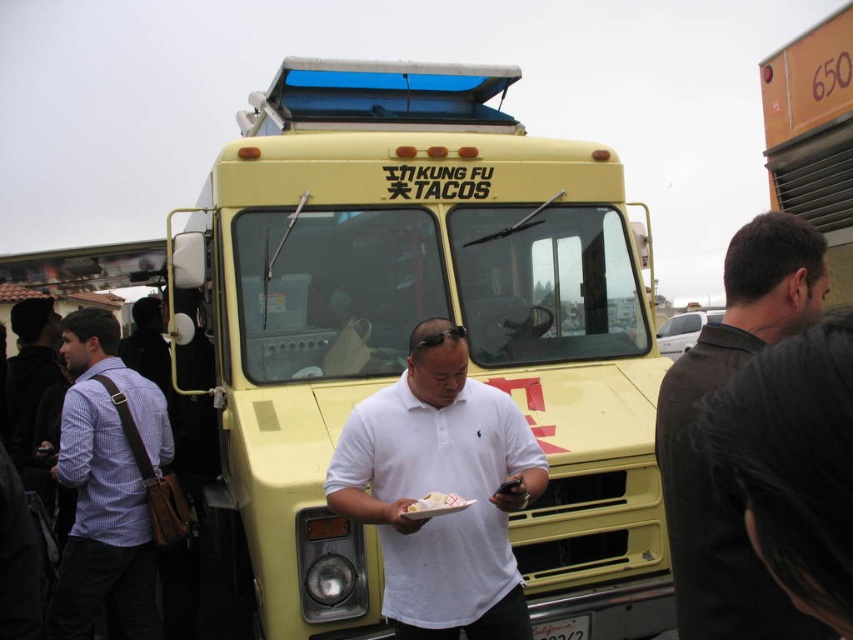
Question: Estimate the real-world distances between objects in this image. Which object is farther from the dark brown leather jacket at right?

Choices:
 (A) yellow plastic food truck at upper right
 (B) yellow matte food truck at center

Answer: (A)

Question: Can you confirm if plaid cotton shirt at left is smaller than white paper plate at center?

Choices:
 (A) no
 (B) yes

Answer: (A)

Question: Which point is farther to the camera?

Choices:
 (A) (680, 602)
 (B) (386, 147)
 (C) (381, 420)
 (D) (91, 324)

Answer: (B)

Question: Among these objects, which one is farthest from the camera?

Choices:
 (A) white paper plate at center
 (B) plaid cotton shirt at left
 (C) yellow matte food truck at center

Answer: (B)

Question: Can you confirm if white matte shirt at center is wider than plaid cotton shirt at left?

Choices:
 (A) no
 (B) yes

Answer: (B)

Question: Is the position of yellow matte food truck at center less distant than that of white paper plate at center?

Choices:
 (A) no
 (B) yes

Answer: (A)